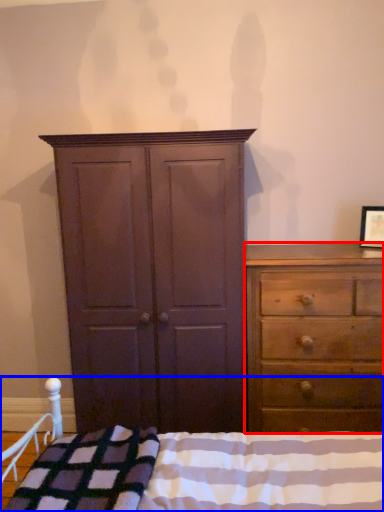
Question: Which point is closer to the camera, chest of drawers (highlighted by a red box) or bed (highlighted by a blue box)?

Choices:
 (A) chest of drawers
 (B) bed

Answer: (B)